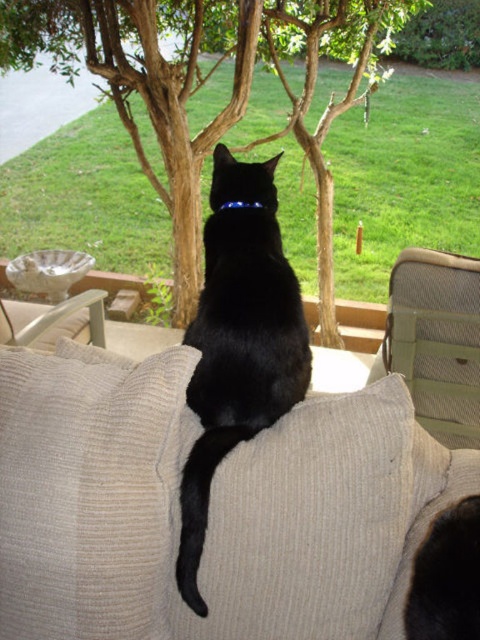
Question: Which of the following is the farthest from the observer?

Choices:
 (A) beige mesh armchair at right
 (B) beige ribbed couch at center
 (C) beige corduroy armchair at left

Answer: (C)

Question: From the image, what is the correct spatial relationship of beige ribbed couch at center in relation to brown rough tree at center?

Choices:
 (A) above
 (B) below

Answer: (B)

Question: Considering the relative positions of black matte fur cat at center and beige mesh armchair at right in the image provided, where is black matte fur cat at center located with respect to beige mesh armchair at right?

Choices:
 (A) left
 (B) right

Answer: (A)

Question: Does black matte fur cat at center appear on the right side of beige mesh armchair at right?

Choices:
 (A) no
 (B) yes

Answer: (A)

Question: Which point is farther from the camera taking this photo?

Choices:
 (A) (82, 323)
 (B) (180, 136)
 (C) (276, 163)

Answer: (B)

Question: Which point is closer to the camera?

Choices:
 (A) black matte fur cat at center
 (B) beige ribbed couch at center
 (C) beige mesh armchair at right
 (D) beige corduroy armchair at left

Answer: (B)